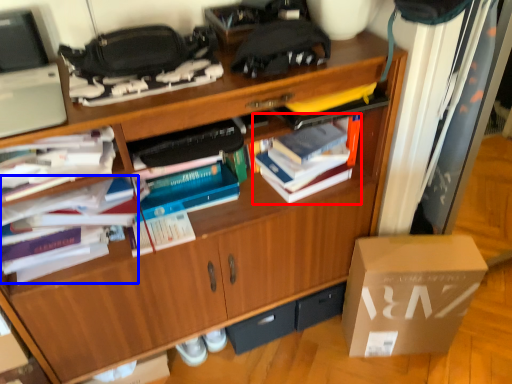
Question: Which object appears closest to the camera in this image, book (highlighted by a red box) or book (highlighted by a blue box)?

Choices:
 (A) book
 (B) book

Answer: (B)